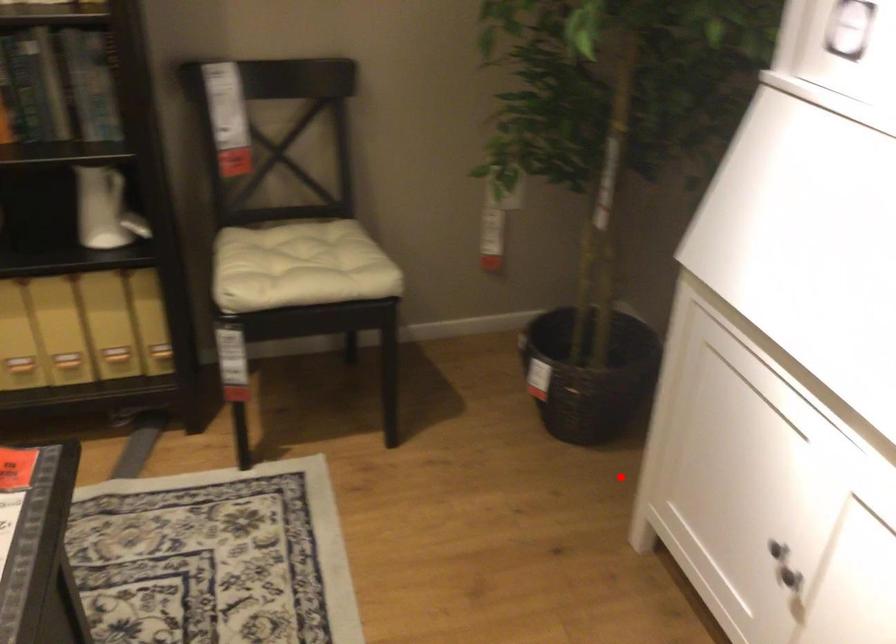
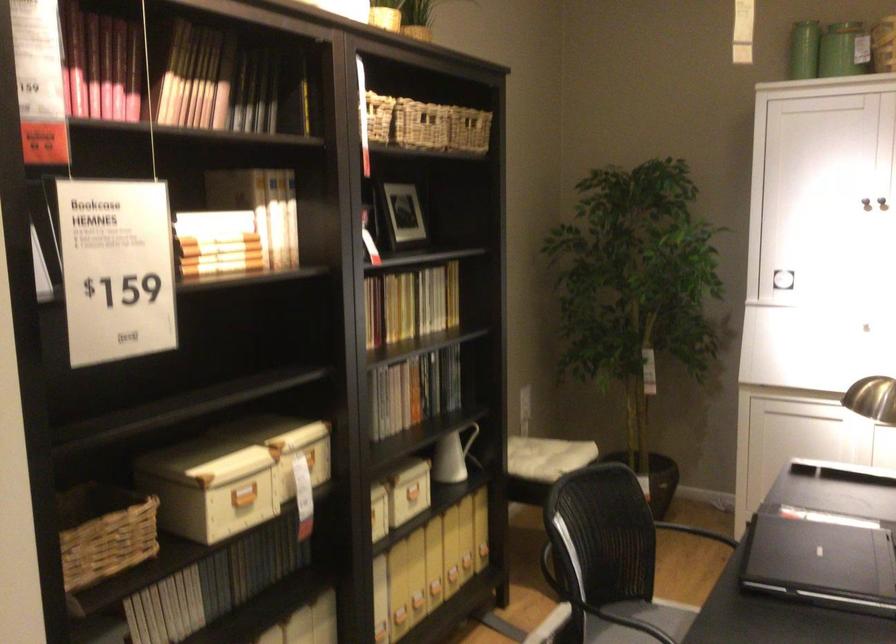
Question: I am providing you with two images of the same scene from different viewpoints. Given a red point in image1, look at the same physical point in image2. Is it:

Choices:
 (A) Closer to the viewpoint
 (B) Farther from the viewpoint

Answer: (B)